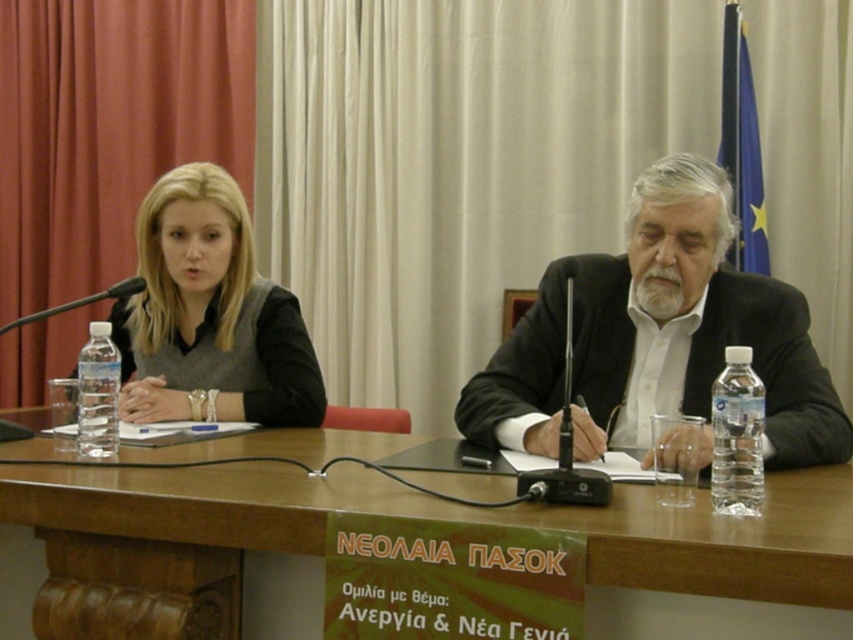
From the picture: You are organizing a photo shoot and need to ensure all items on the table are visible in the frame. The white matte suit at center and the clear plastic bottle at right are both on the table. Which item might require more space in the frame to capture fully?

The white matte suit at center is larger in size than the clear plastic bottle at right, so it would require more space in the frame to capture fully.

You are organizing a small event and need to place a decorative centerpiece on the brown wooden table at center. Considering the clear plastic bottle at right, will there be enough space on the table to place the centerpiece without it overlapping the bottle?

The brown wooden table at center might be wider than clear plastic bottle at right, so there could be sufficient space to place the centerpiece without overlapping the bottle, but the exact dimensions are uncertain.